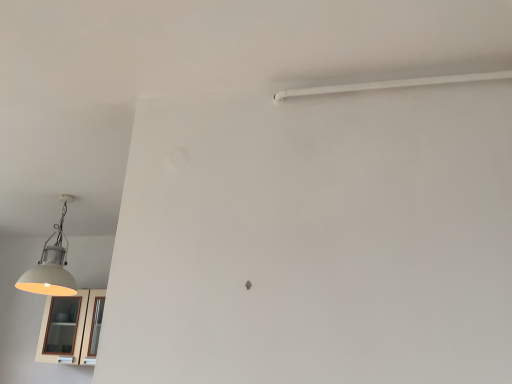
Locate an element on the screen. white matte pendant light at upper left is located at coordinates (51, 265).

What do you see at coordinates (51, 265) in the screenshot? I see `white matte pendant light at upper left` at bounding box center [51, 265].

Consider the image. What is the approximate width of white matte pendant light at upper left?

The width of white matte pendant light at upper left is 15.03 inches.

At what (x,y) coordinates should I click in order to perform the action: click on white matte pendant light at upper left. Please return your answer as a coordinate pair (x, y). This screenshot has width=512, height=384. Looking at the image, I should click on (51, 265).